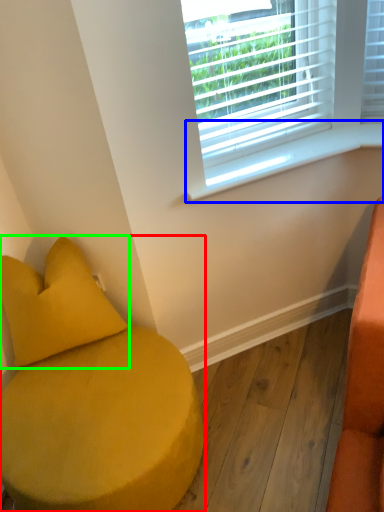
Question: Which is nearer to the furniture (highlighted by a red box)? window sill (highlighted by a blue box) or pillow (highlighted by a green box).

Choices:
 (A) window sill
 (B) pillow

Answer: (B)